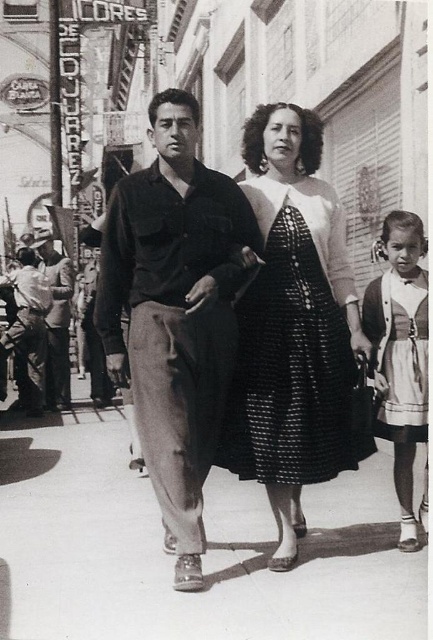
Is matte black jacket at left to the right of smooth leather jacket at left from the viewer's perspective?

Correct, you'll find matte black jacket at left to the right of smooth leather jacket at left.

Who is positioned more to the left, matte black jacket at left or smooth leather jacket at left?

From the viewer's perspective, smooth leather jacket at left appears more on the left side.

Where is `matte black jacket at left`? The height and width of the screenshot is (640, 433). matte black jacket at left is located at coordinates (28, 330).

Who is lower down, white cotton dirndl at right or smooth leather jacket at left?

white cotton dirndl at right is below.

From the picture: Which of these two, white cotton dirndl at right or smooth leather jacket at left, stands shorter?

With less height is white cotton dirndl at right.

Is point (407, 401) in front of point (67, 387)?

Yes.

The image size is (433, 640). Identify the location of white cotton dirndl at right. (403, 365).

Who is lower down, smooth black shirt at center or smooth leather jacket at left?

smooth black shirt at center is below.

You are a GUI agent. You are given a task and a screenshot of the screen. Output one action in this format:
    pyautogui.click(x=<x>, y=<y>)
    Task: Click on the smooth black shirt at center
    The image size is (433, 640).
    Given the screenshot: What is the action you would take?
    pyautogui.click(x=175, y=312)

The height and width of the screenshot is (640, 433). Describe the element at coordinates (175, 312) in the screenshot. I see `smooth black shirt at center` at that location.

The image size is (433, 640). What are the coordinates of `smooth black shirt at center` in the screenshot? It's located at (175, 312).